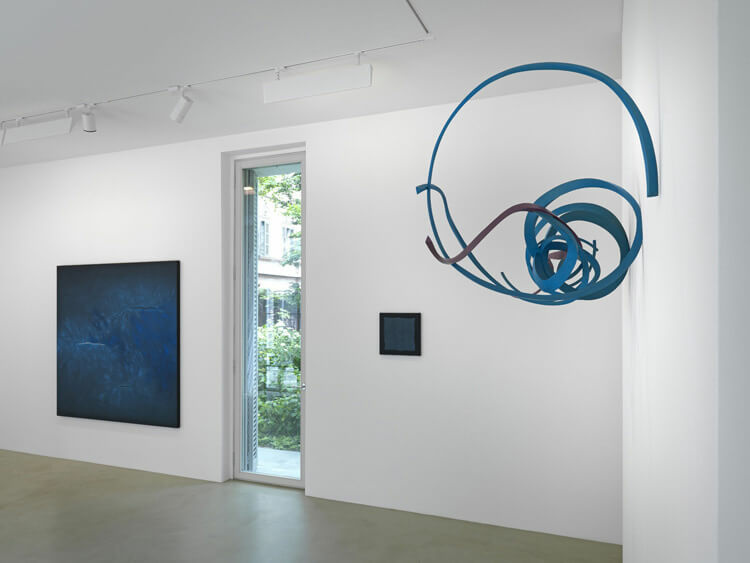
Where is `art`? art is located at coordinates (572, 271).